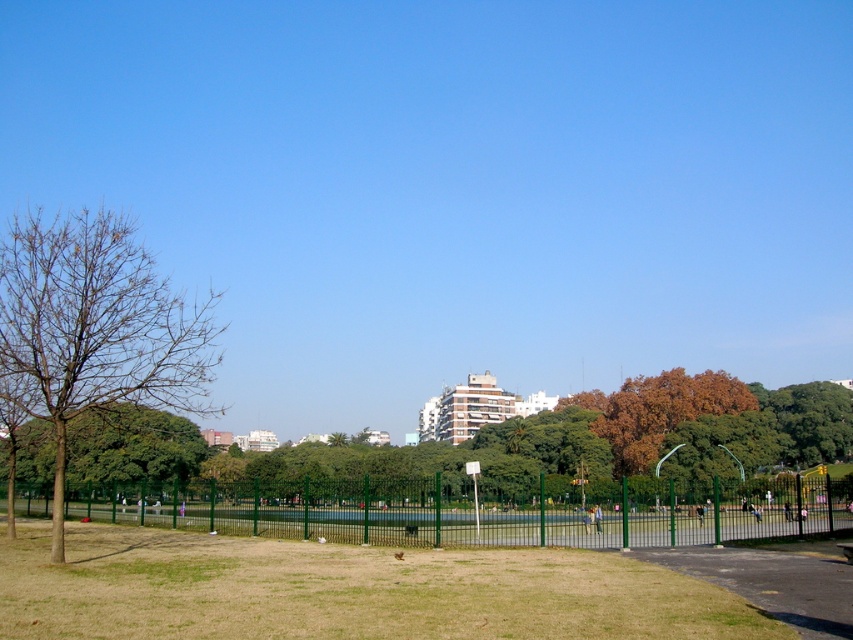
Locate an element on the screen. This screenshot has height=640, width=853. green metal fence at center is located at coordinates (479, 509).

Who is higher up, green metal fence at center or bare wood tree at left?

bare wood tree at left is higher up.

Who is more distant from viewer, [303,480] or [102,330]?

The point [303,480] is more distant.

Locate an element on the screen. green metal fence at center is located at coordinates (479, 509).

Can you confirm if brown leafy tree at center is positioned to the left of green metal fence at center?

No, brown leafy tree at center is not to the left of green metal fence at center.

Which is behind, point (524, 445) or point (613, 536)?

The point (524, 445) is more distant.

Does point (129, 458) lie behind point (791, 524)?

Yes, point (129, 458) is behind point (791, 524).

Locate an element on the screen. brown leafy tree at center is located at coordinates (508, 442).

Does green grassy field at lower center have a larger size compared to bare wood tree at left?

Incorrect, green grassy field at lower center is not larger than bare wood tree at left.

Who is more distant from viewer, (444, 605) or (44, 221)?

Positioned behind is point (44, 221).

Who is more forward, (555,576) or (122,276)?

Positioned in front is point (555,576).

In order to click on green grassy field at lower center in this screenshot , I will do `click(345, 589)`.